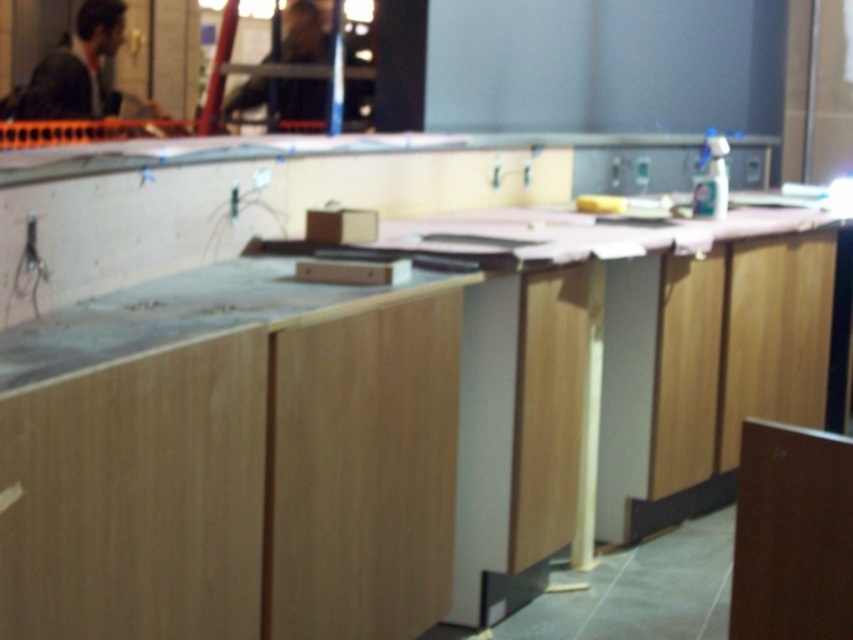
Question: Where is wooden counter at center located in relation to dark brown leather jacket at upper center in the image?

Choices:
 (A) above
 (B) below

Answer: (B)

Question: Does matte black suit at upper left have a greater width compared to dark brown leather jacket at upper center?

Choices:
 (A) yes
 (B) no

Answer: (B)

Question: Considering the real-world distances, which object is closest to the matte black suit at upper left?

Choices:
 (A) dark brown leather jacket at upper center
 (B) wooden counter at center

Answer: (A)

Question: Based on their relative distances, which object is nearer to the dark brown leather jacket at upper center?

Choices:
 (A) wooden counter at center
 (B) matte black suit at upper left

Answer: (B)

Question: Which object is farther from the camera taking this photo?

Choices:
 (A) dark brown leather jacket at upper center
 (B) wooden counter at center

Answer: (A)

Question: Is matte black suit at upper left above dark brown leather jacket at upper center?

Choices:
 (A) yes
 (B) no

Answer: (A)